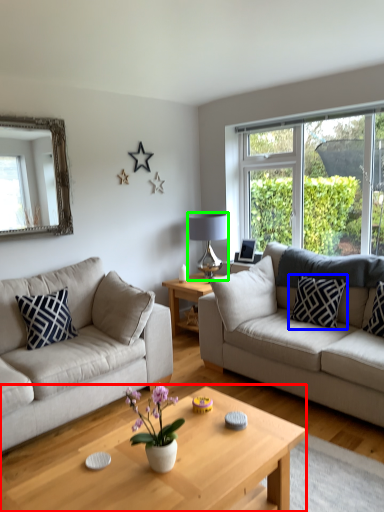
Question: Which object is the closest to the coffee table (highlighted by a red box)? Choose among these: pillow (highlighted by a blue box) or lamp (highlighted by a green box).

Choices:
 (A) pillow
 (B) lamp

Answer: (A)